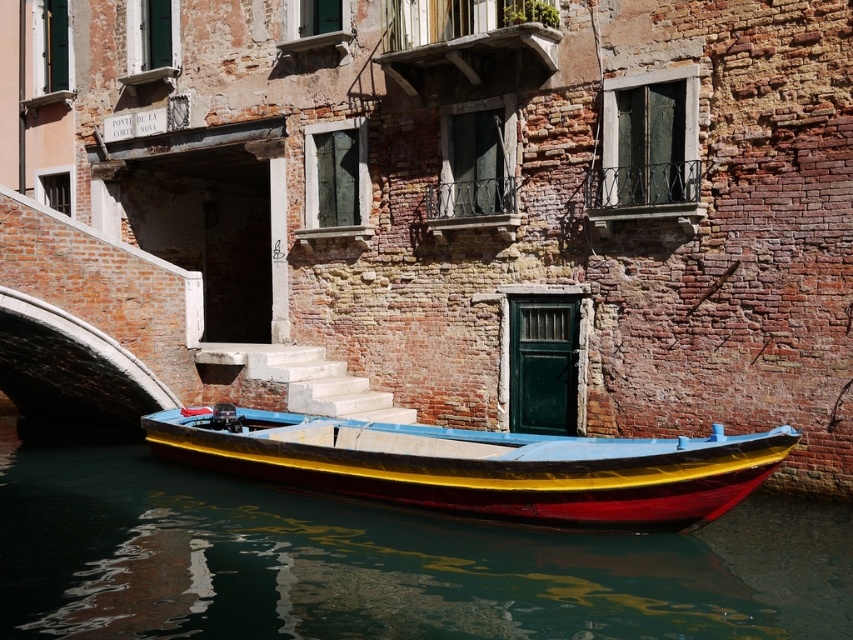
You are a tourist standing on the canal bridge. You see the smooth water at boat center and the shiny wood boat at center. Which one is higher from the ground level?

The smooth water at boat center is taller than the shiny wood boat at center, so the smooth water at boat center is higher from the ground level.

Based on the photo, you are standing on the gondola and looking at two points in the scene. The first point is at coordinate point (502, 538) and the second point is at coordinate point (181, 444). Which point is closer to you?

Point (502, 538) is closer to the camera than point (181, 444).

You are a tourist standing on the canal bridge and want to take a photo of the shiny wood boat at center. To get the best reflection shot, where should you position yourself relative to the smooth water at boat center?

You should position yourself to the left of the shiny wood boat at center because the smooth water at boat center is located to the left of the shiny wood boat at center, providing the best reflection area for your photo.